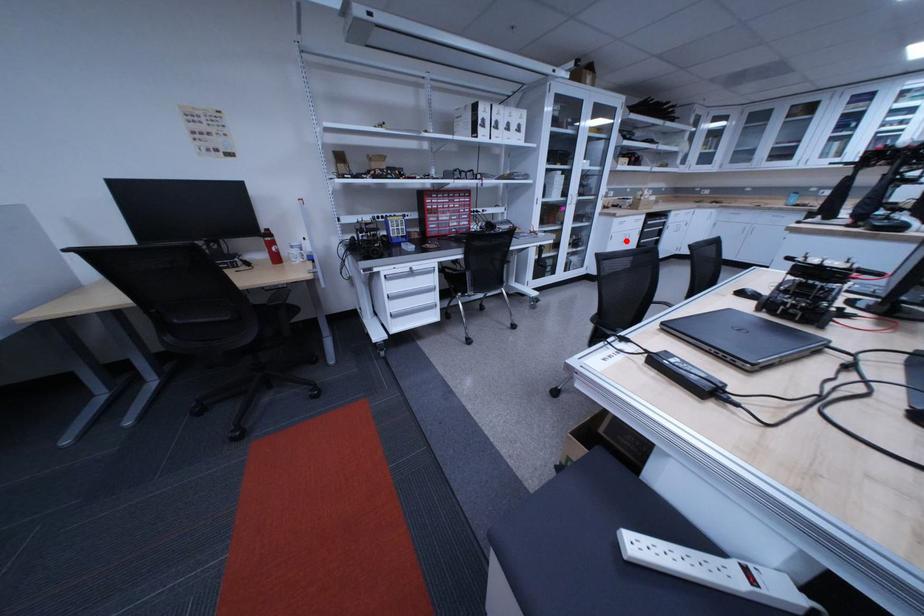
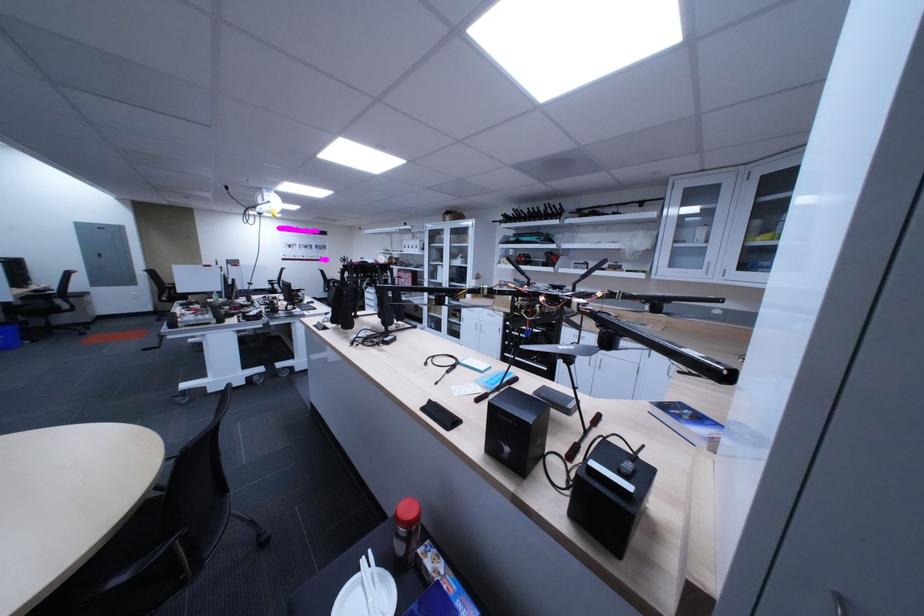
In the second image, find the point that corresponds to the highlighted location in the first image.

(478, 323)